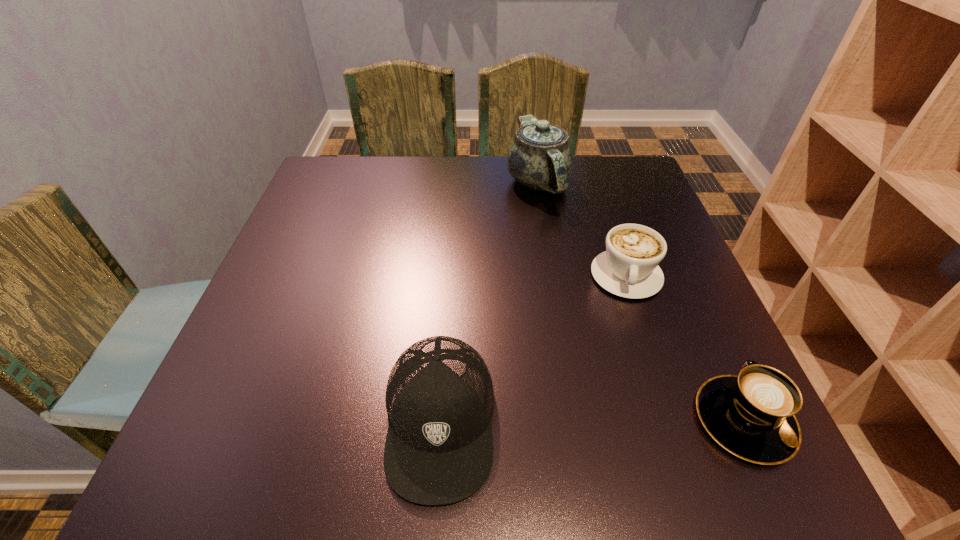
Locate an element on the screen. The image size is (960, 540). free spot on the desktop that is between the third shortest object and the nearer cappuccino and is positioned from the spout of the chinaware is located at coordinates (560, 420).

Image resolution: width=960 pixels, height=540 pixels. In order to click on free space on the desktop that is between the cap and the nearer cappuccino and is positioned to the right of the farther cappuccino's handle in this screenshot , I will do `click(633, 420)`.